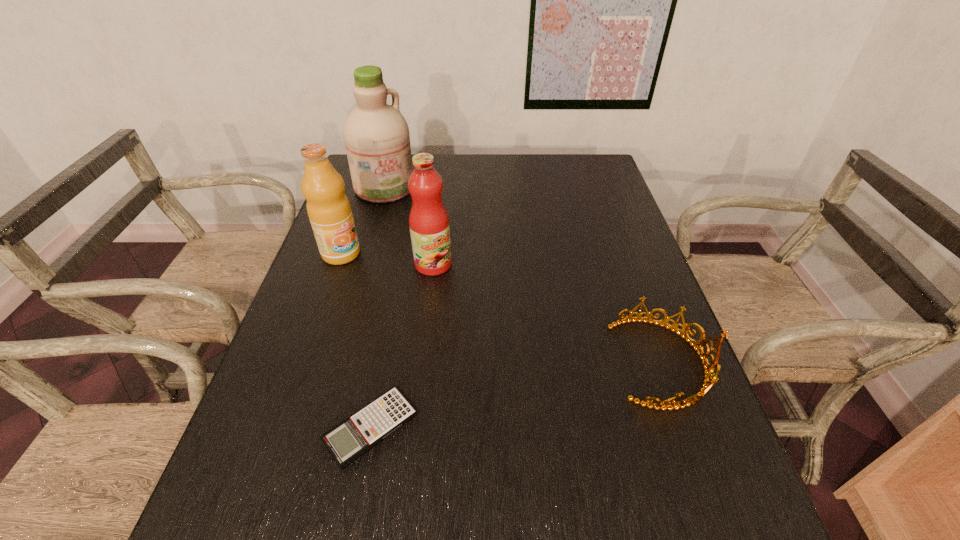
Find the location of a particular element. Image resolution: width=960 pixels, height=540 pixels. the closest object relative to the tallest object is located at coordinates (329, 211).

Locate which object ranks fourth in proximity to the farthest object. Please provide its 2D coordinates. Your answer should be formatted as a tuple, i.e. [(x, y)], where the tuple contains the x and y coordinates of a point satisfying the conditions above.

[(708, 381)]

Locate an element on the screen. vacant region that satisfies the following two spatial constraints: 1. on the front side of the left fruit juice; 2. on the left side of the right fruit juice is located at coordinates (338, 264).

Locate an element on the screen. free location that satisfies the following two spatial constraints: 1. on the back side of the left fruit juice; 2. on the right side of the tallest object is located at coordinates (365, 187).

This screenshot has height=540, width=960. Find the location of `vacant area that satisfies the following two spatial constraints: 1. on the front side of the tiara; 2. on the front-facing side of the tallest object`. vacant area that satisfies the following two spatial constraints: 1. on the front side of the tiara; 2. on the front-facing side of the tallest object is located at coordinates (333, 362).

Identify the location of free space that satisfies the following two spatial constraints: 1. on the front side of the tiara; 2. on the front-facing side of the farthest object. The image size is (960, 540). (333, 362).

Locate an element on the screen. free space in the image that satisfies the following two spatial constraints: 1. on the back side of the right fruit juice; 2. on the left side of the calculator is located at coordinates (402, 264).

Where is `free point that satisfies the following two spatial constraints: 1. on the back side of the calculator; 2. on the front-facing side of the tiara`? free point that satisfies the following two spatial constraints: 1. on the back side of the calculator; 2. on the front-facing side of the tiara is located at coordinates (383, 362).